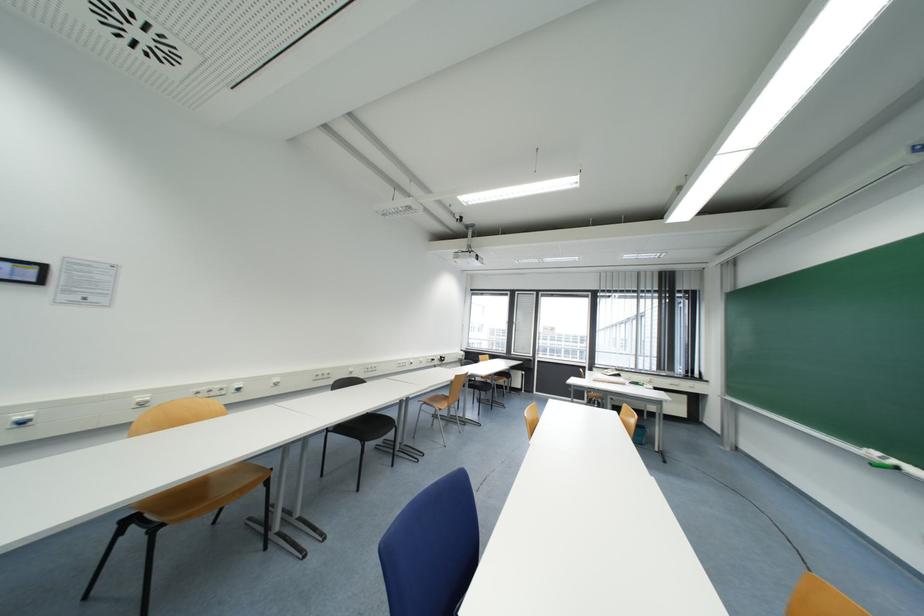
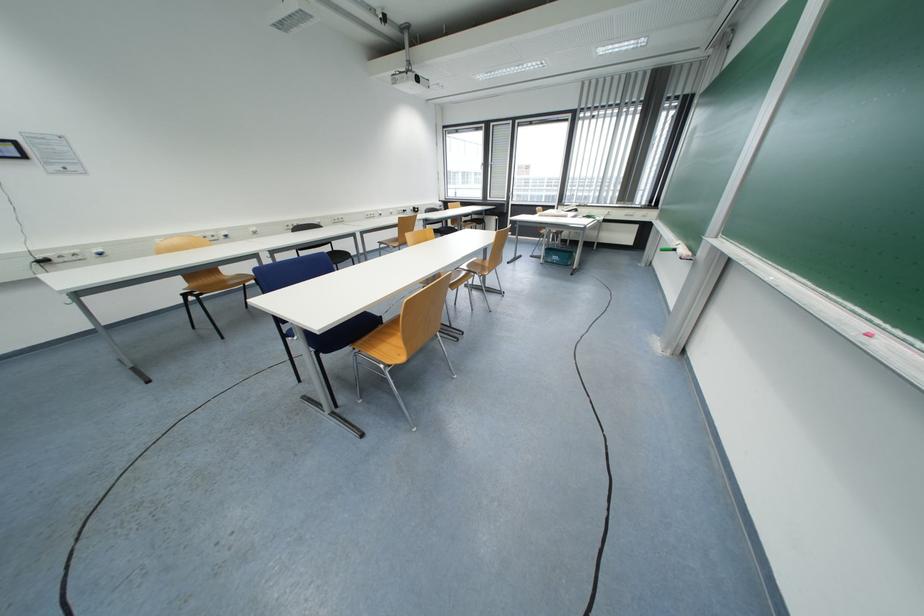
Where in the second image is the point corresponding to point 882,455 from the first image?

(683, 244)